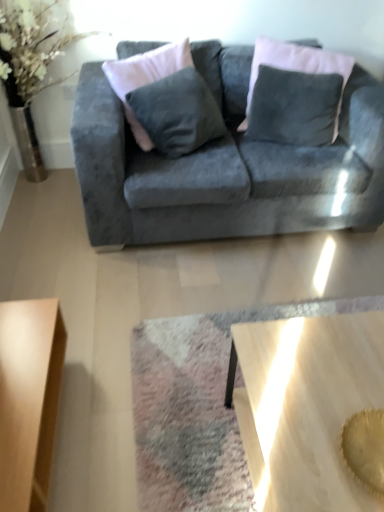
Question: Can you confirm if light brown wooden coffee table at lower left, which ranks as the 2th coffee table in right-to-left order, is thinner than wooden polished coffee table at lower center, arranged as the second coffee table when viewed from the left?

Choices:
 (A) no
 (B) yes

Answer: (B)

Question: Is light brown wooden coffee table at lower left, which ranks as the 2th coffee table in right-to-left order, turned away from wooden polished coffee table at lower center, arranged as the second coffee table when viewed from the left?

Choices:
 (A) yes
 (B) no

Answer: (B)

Question: Are light brown wooden coffee table at lower left, the first coffee table viewed from the left, and wooden polished coffee table at lower center, which is the 1th coffee table from right to left, beside each other?

Choices:
 (A) no
 (B) yes

Answer: (A)

Question: From the image's perspective, is light brown wooden coffee table at lower left, which ranks as the 2th coffee table in right-to-left order, beneath wooden polished coffee table at lower center, arranged as the second coffee table when viewed from the left?

Choices:
 (A) no
 (B) yes

Answer: (A)

Question: Is light brown wooden coffee table at lower left, which ranks as the 2th coffee table in right-to-left order, shorter than wooden polished coffee table at lower center, which is the 1th coffee table from right to left?

Choices:
 (A) no
 (B) yes

Answer: (B)

Question: Can we say light brown wooden coffee table at lower left, which ranks as the 2th coffee table in right-to-left order, lies outside wooden polished coffee table at lower center, which is the 1th coffee table from right to left?

Choices:
 (A) yes
 (B) no

Answer: (A)

Question: Is velvet dark gray pillow at upper center positioned far away from light brown wooden coffee table at lower left, the first coffee table viewed from the left?

Choices:
 (A) yes
 (B) no

Answer: (A)

Question: Considering the relative sizes of velvet dark gray pillow at upper center and light brown wooden coffee table at lower left, which ranks as the 2th coffee table in right-to-left order, in the image provided, is velvet dark gray pillow at upper center wider than light brown wooden coffee table at lower left, which ranks as the 2th coffee table in right-to-left order,?

Choices:
 (A) no
 (B) yes

Answer: (A)

Question: Is velvet dark gray pillow at upper center positioned in front of light brown wooden coffee table at lower left, which ranks as the 2th coffee table in right-to-left order?

Choices:
 (A) no
 (B) yes

Answer: (A)

Question: From a real-world perspective, is velvet dark gray pillow at upper center located higher than light brown wooden coffee table at lower left, the first coffee table viewed from the left?

Choices:
 (A) yes
 (B) no

Answer: (A)

Question: Is velvet dark gray pillow at upper center turned away from light brown wooden coffee table at lower left, the first coffee table viewed from the left?

Choices:
 (A) yes
 (B) no

Answer: (B)

Question: Is velvet dark gray pillow at upper center facing towards light brown wooden coffee table at lower left, which ranks as the 2th coffee table in right-to-left order?

Choices:
 (A) yes
 (B) no

Answer: (A)

Question: Can you confirm if velvet gray couch at center is thinner than wooden polished coffee table at lower center, which is the 1th coffee table from right to left?

Choices:
 (A) yes
 (B) no

Answer: (B)